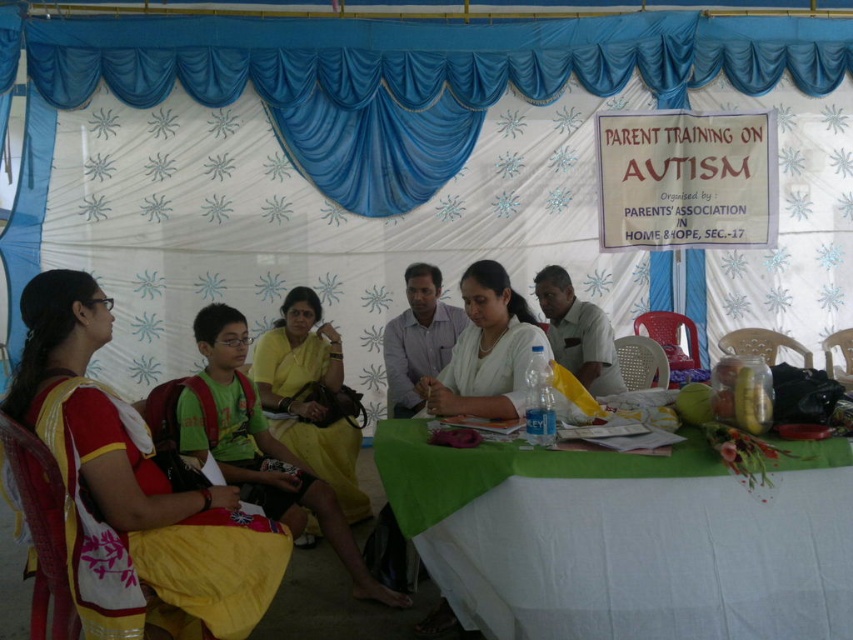
Question: Estimate the real-world distances between objects in this image. Which object is closer to the light brown shirt at center?

Choices:
 (A) green cloth table at center
 (B) yellow fabric dress at center
 (C) blue fabric curtain at upper center

Answer: (B)

Question: Among these objects, which one is nearest to the camera?

Choices:
 (A) light brown shirt at center
 (B) white glossy shirt at center
 (C) blue fabric curtain at upper center
 (D) light blue shirt at center

Answer: (B)

Question: Which of the following is the farthest from the observer?

Choices:
 (A) (318, 348)
 (B) (809, 225)

Answer: (B)

Question: Does yellow cotton saree at left appear under yellow fabric dress at center?

Choices:
 (A) yes
 (B) no

Answer: (B)

Question: Considering the relative positions of white glossy shirt at center and light brown shirt at center in the image provided, where is white glossy shirt at center located with respect to light brown shirt at center?

Choices:
 (A) right
 (B) left

Answer: (B)

Question: Does green cloth table at center appear over green fabric shirt at center?

Choices:
 (A) yes
 (B) no

Answer: (B)